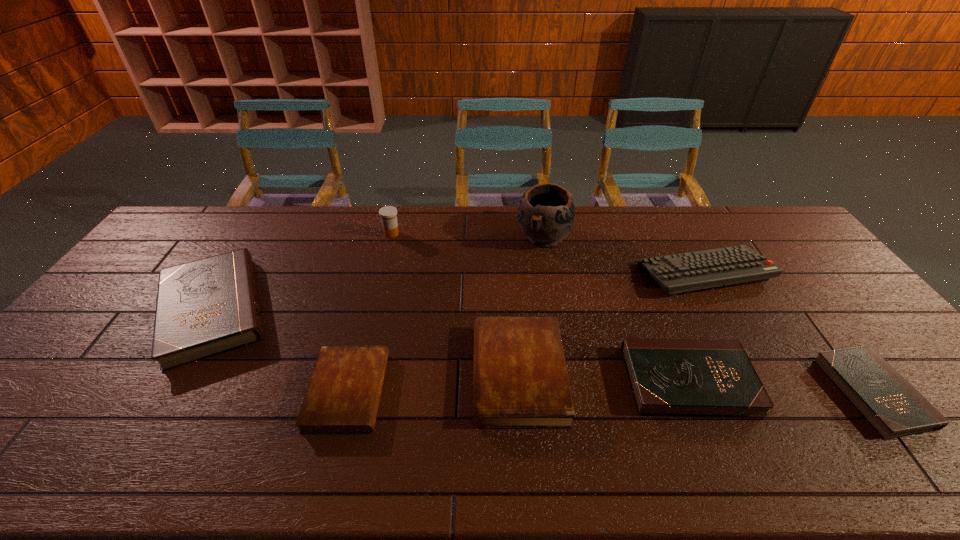
You are a GUI agent. You are given a task and a screenshot of the screen. Output one action in this format:
    pyautogui.click(x=<x>, y=<y>)
    Task: Click on the blue pottery
    
    Given the screenshot: What is the action you would take?
    pyautogui.click(x=546, y=213)

At what (x,y) coordinates should I click in order to perform the action: click on the tallest object. Please return your answer as a coordinate pair (x, y). Looking at the image, I should click on (546, 213).

At what (x,y) coordinates should I click in order to perform the action: click on medicine. Please return your answer as a coordinate pair (x, y). This screenshot has width=960, height=540. Looking at the image, I should click on (388, 214).

Find the location of a particular element. The width and height of the screenshot is (960, 540). the second tallest object is located at coordinates (388, 214).

You are a GUI agent. You are given a task and a screenshot of the screen. Output one action in this format:
    pyautogui.click(x=<x>, y=<y>)
    Task: Click on the gray computer keyboard
    Image resolution: width=960 pixels, height=540 pixels.
    Given the screenshot: What is the action you would take?
    [x=677, y=273]

Locate an element on the screen. the leftmost Bible is located at coordinates (206, 307).

You are a GUI agent. You are given a task and a screenshot of the screen. Output one action in this format:
    pyautogui.click(x=<x>, y=<y>)
    Task: Click on the leftmost object
    The height and width of the screenshot is (540, 960).
    Given the screenshot: What is the action you would take?
    pyautogui.click(x=206, y=307)

The image size is (960, 540). In order to click on the right reddish-brown Bible in this screenshot , I will do `click(520, 381)`.

Image resolution: width=960 pixels, height=540 pixels. Identify the location of the third Bible from right to left. (520, 381).

You are a GUI agent. You are given a task and a screenshot of the screen. Output one action in this format:
    pyautogui.click(x=<x>, y=<y>)
    Task: Click on the fourth Bible from left to right
    
    Given the screenshot: What is the action you would take?
    pyautogui.click(x=669, y=377)